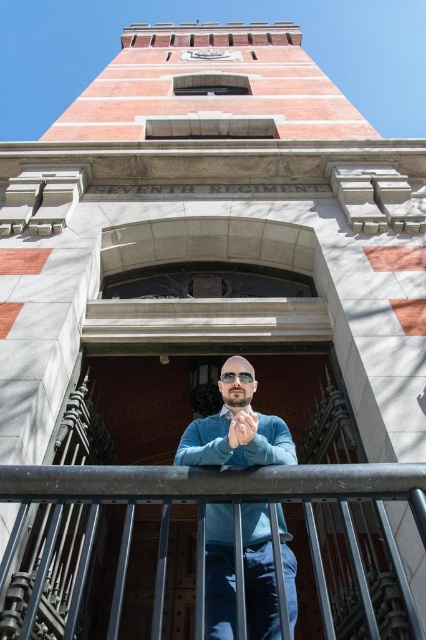
Question: Among these objects, which one is farthest from the camera?

Choices:
 (A) matte blue hand at center
 (B) metallic steel balustrade at lower center

Answer: (A)

Question: Can you confirm if metallic steel balustrade at lower center is thinner than matte blue hand at center?

Choices:
 (A) yes
 (B) no

Answer: (B)

Question: Which point is farther to the camera?

Choices:
 (A) blue sweater at center
 (B) metallic steel balustrade at lower center
 (C) matte blue hand at center
 (D) clear plastic goggles at center

Answer: (D)

Question: Does blue sweater at center have a lesser width compared to clear plastic goggles at center?

Choices:
 (A) yes
 (B) no

Answer: (B)

Question: Does metallic steel balustrade at lower center have a greater width compared to matte blue hand at center?

Choices:
 (A) no
 (B) yes

Answer: (B)

Question: Which of the following is the farthest from the observer?

Choices:
 (A) clear plastic goggles at center
 (B) matte blue hand at center
 (C) metallic steel balustrade at lower center

Answer: (A)